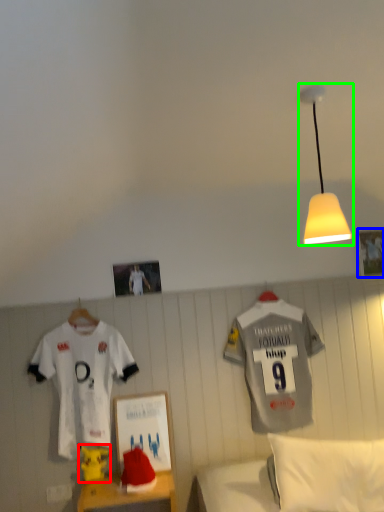
Question: Considering the real-world distances, which object is closest to toy (highlighted by a red box)? picture frame (highlighted by a blue box) or lamp (highlighted by a green box).

Choices:
 (A) picture frame
 (B) lamp

Answer: (B)